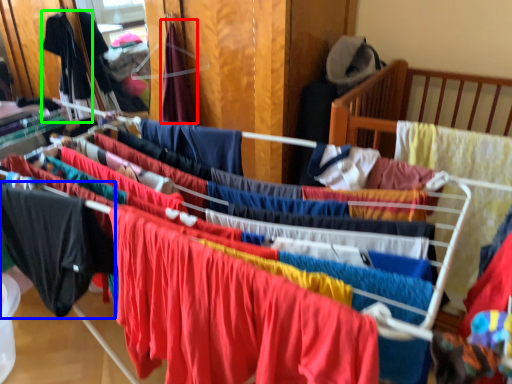
Question: Which object is the farthest from clothing (highlighted by a red box)? Choose among these: clothing (highlighted by a blue box) or clothing (highlighted by a green box).

Choices:
 (A) clothing
 (B) clothing

Answer: (A)